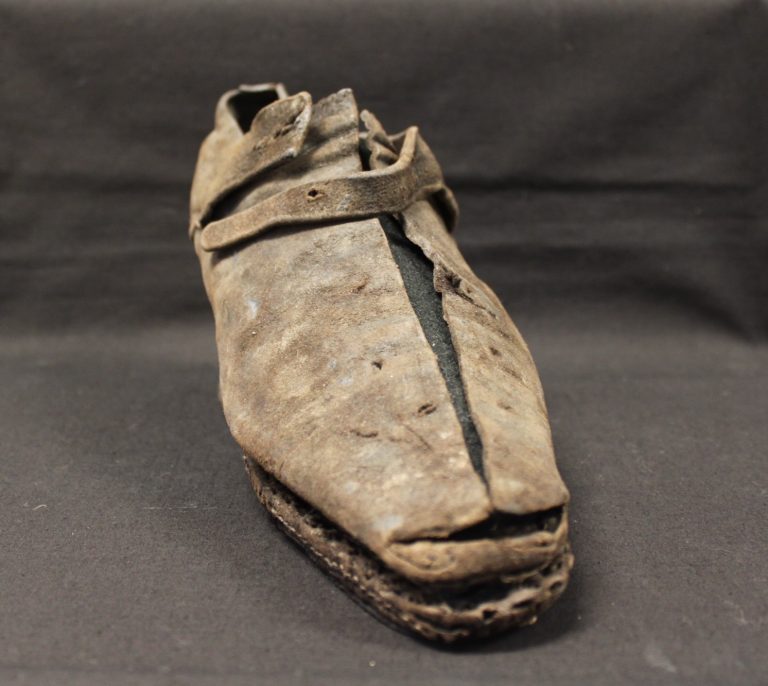
Locate where you put your foot to put shoe on in the image. Your answer should be formatted as a list of tuples, i.e. [(x1, y1), (x2, y2), ...], where each tuple contains the x and y coordinates of a point satisfying the conditions above.

[(247, 103)]